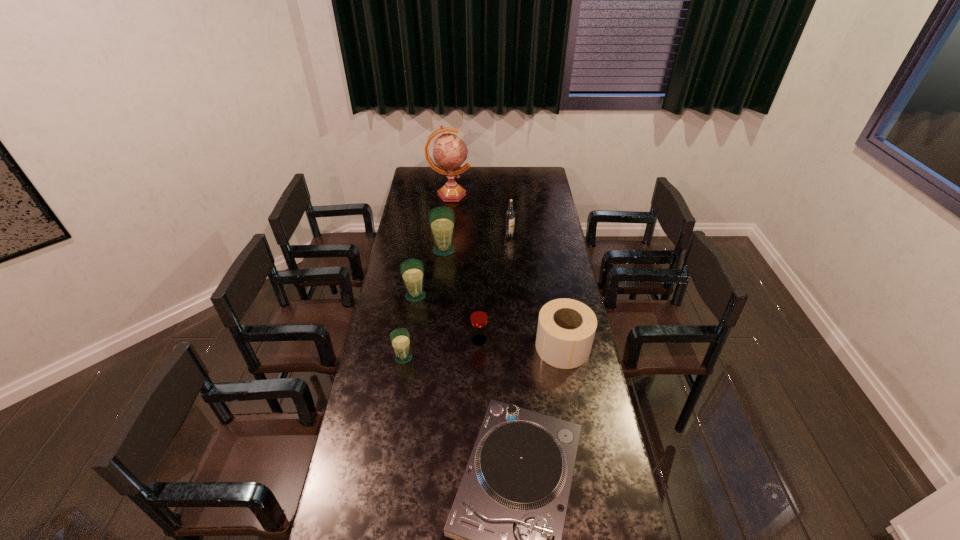
Where is `glass object that ranks as the closest to the rightmost glass`? glass object that ranks as the closest to the rightmost glass is located at coordinates (400, 339).

Locate which glass ranks second in proximity to the third nearest glass. Please provide its 2D coordinates. Your answer should be formatted as a tuple, i.e. [(x, y)], where the tuple contains the x and y coordinates of a point satisfying the conditions above.

[(400, 339)]

Locate which blue glass is the second closest to the shortest object. Please provide its 2D coordinates. Your answer should be formatted as a tuple, i.e. [(x, y)], where the tuple contains the x and y coordinates of a point satisfying the conditions above.

[(412, 270)]

I want to click on blue glass that is the third closest to the rightmost glass, so click(x=441, y=219).

This screenshot has width=960, height=540. What are the coordinates of `blank area in the image that satisfies the following two spatial constraints: 1. on the back side of the rightmost glass; 2. on the front-facing side of the tallest object` in the screenshot? It's located at (479, 194).

Locate an element on the screen. vacant point that satisfies the following two spatial constraints: 1. on the back side of the farthest blue glass; 2. on the right side of the second biggest blue glass is located at coordinates (422, 250).